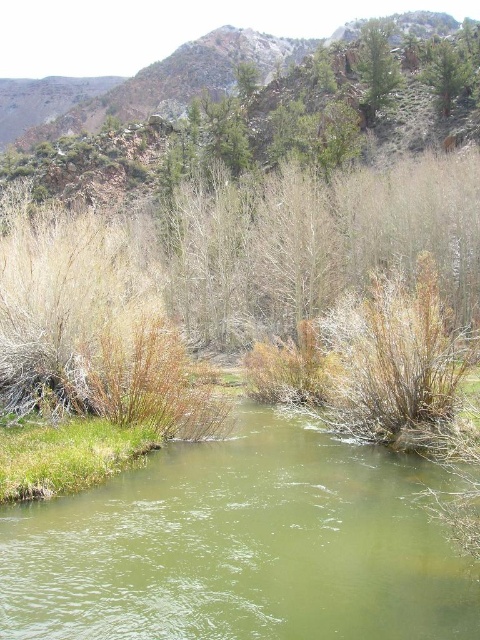
Question: Does green grassy bank at lower left appear over green leafy tree at upper center?

Choices:
 (A) no
 (B) yes

Answer: (A)

Question: Does green leafy tree at upper center lie in front of green leafy tree at upper right?

Choices:
 (A) no
 (B) yes

Answer: (A)

Question: Is green grassy stream at center further to the viewer compared to green leafy tree at upper right?

Choices:
 (A) yes
 (B) no

Answer: (B)

Question: Which point is farther to the camera?

Choices:
 (A) (201, 576)
 (B) (31, 492)
 (C) (440, 100)
 (D) (381, 54)

Answer: (D)

Question: Among these points, which one is nearest to the camera?

Choices:
 (A) (376, 48)
 (B) (104, 465)
 (C) (452, 54)
 (D) (269, 499)

Answer: (D)

Question: Among these points, which one is farthest from the camera?

Choices:
 (A) (365, 28)
 (B) (90, 554)
 (C) (448, 90)

Answer: (A)